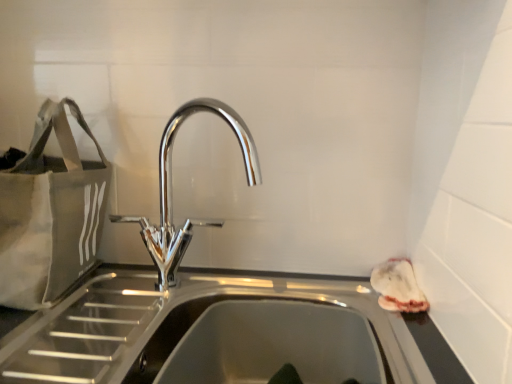
Question: Based on their positions, is matte gray tote at left located to the left or right of chrome metallic tap at center?

Choices:
 (A) left
 (B) right

Answer: (A)

Question: Considering the positions of matte gray tote at left and chrome metallic tap at center in the image, is matte gray tote at left wider or thinner than chrome metallic tap at center?

Choices:
 (A) thin
 (B) wide

Answer: (B)

Question: Considering the positions of point (54, 130) and point (182, 244), is point (54, 130) closer or farther from the camera than point (182, 244)?

Choices:
 (A) closer
 (B) farther

Answer: (A)

Question: From the image's perspective, is chrome metallic tap at center positioned above or below matte gray tote at left?

Choices:
 (A) above
 (B) below

Answer: (B)

Question: Considering the positions of chrome metallic tap at center and matte gray tote at left in the image, is chrome metallic tap at center wider or thinner than matte gray tote at left?

Choices:
 (A) wide
 (B) thin

Answer: (B)

Question: Considering their positions, is chrome metallic tap at center located in front of or behind matte gray tote at left?

Choices:
 (A) behind
 (B) front

Answer: (B)

Question: In terms of height, does chrome metallic tap at center look taller or shorter compared to matte gray tote at left?

Choices:
 (A) short
 (B) tall

Answer: (A)